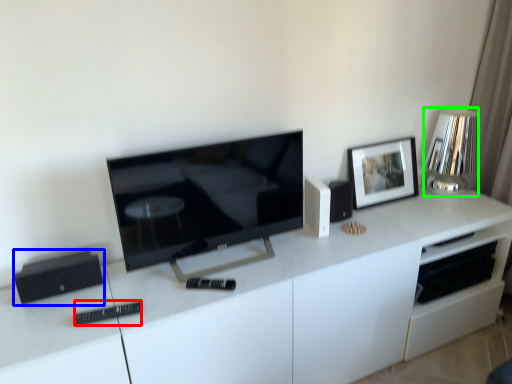
Question: Estimate the real-world distances between objects in this image. Which object is farther from remote (highlighted by a red box), appliance (highlighted by a blue box) or lamp (highlighted by a green box)?

Choices:
 (A) appliance
 (B) lamp

Answer: (B)